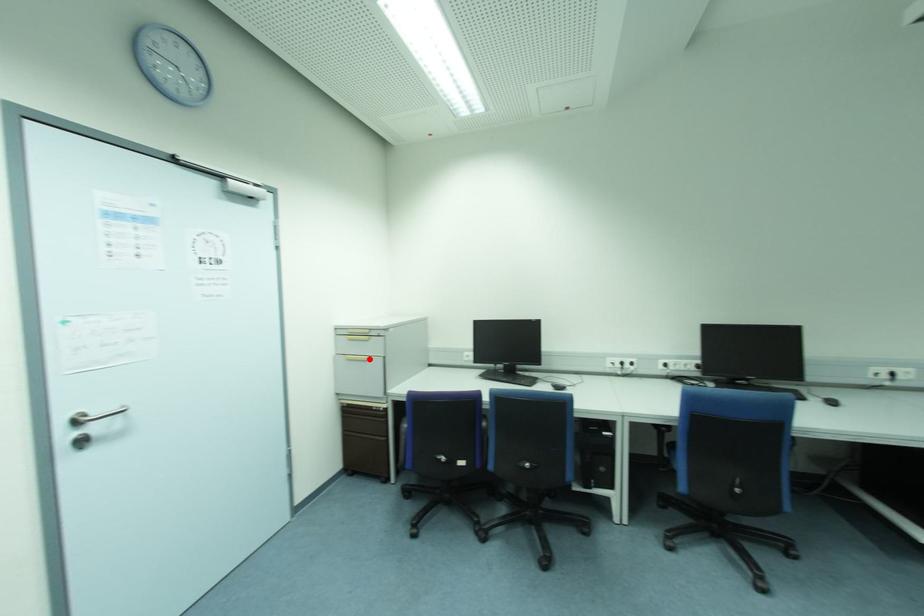
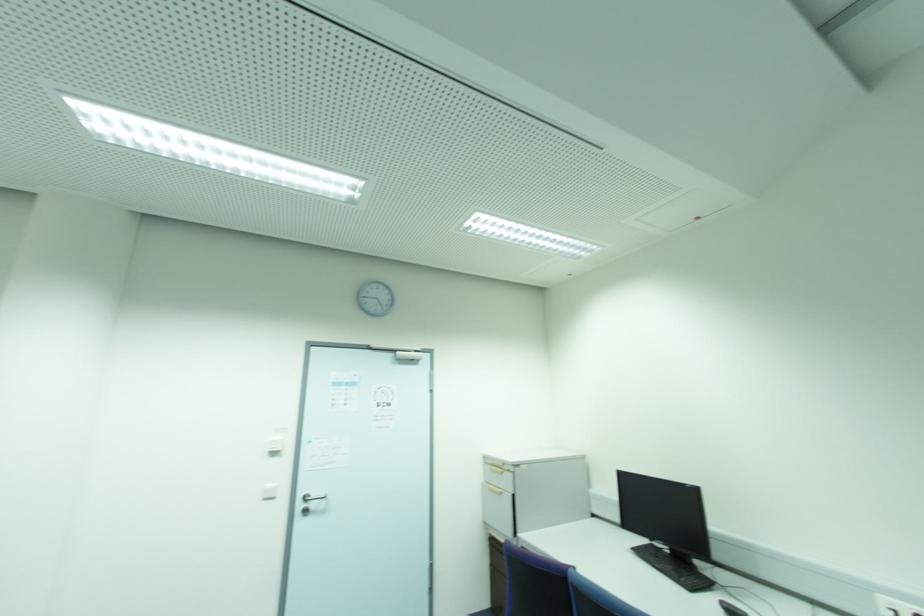
Question: I am providing you with two images of the same scene from different viewpoints. Given a red point in image1, look at the same physical point in image2. Is it:

Choices:
 (A) Closer to the viewpoint
 (B) Farther from the viewpoint

Answer: (B)